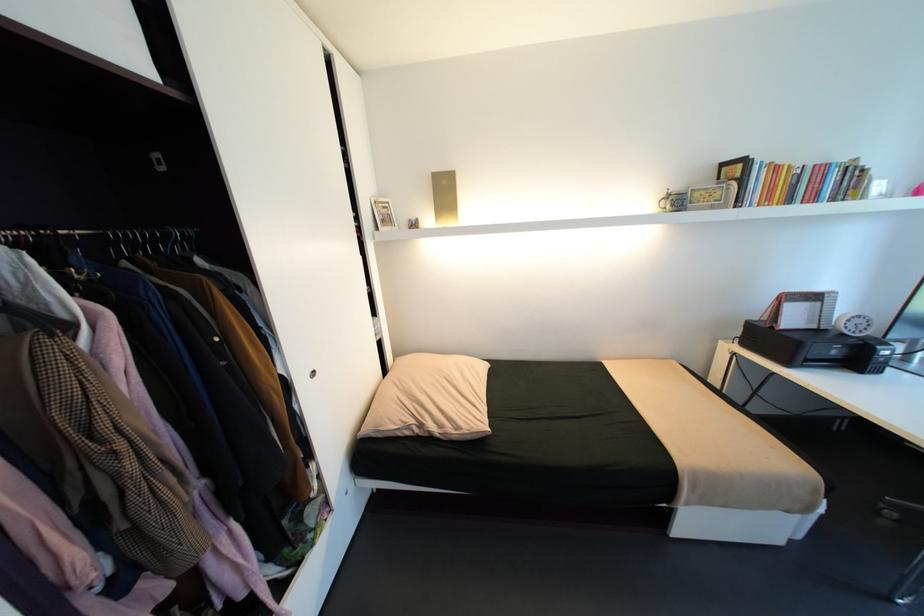
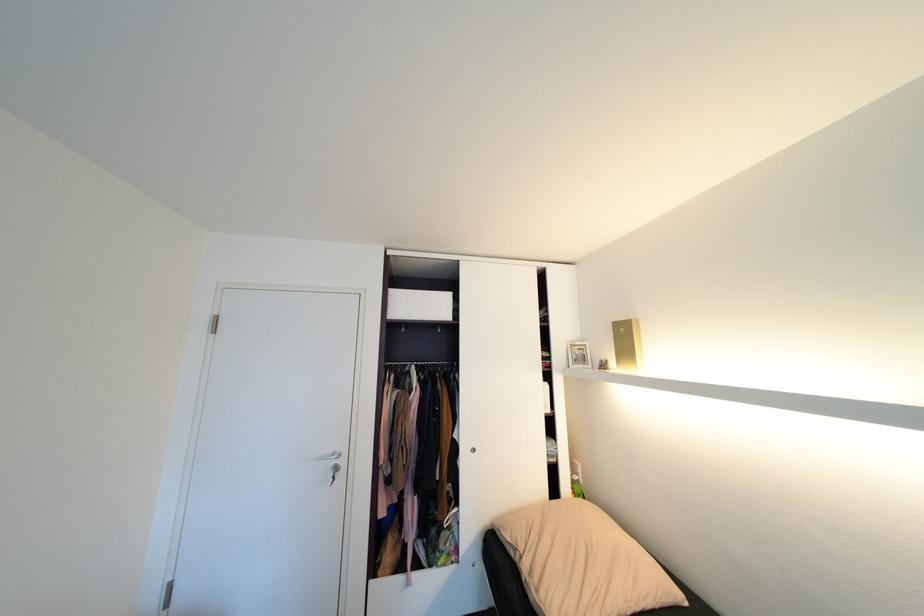
In the second image, find the point that corresponds to (415,432) in the first image.

(518, 554)